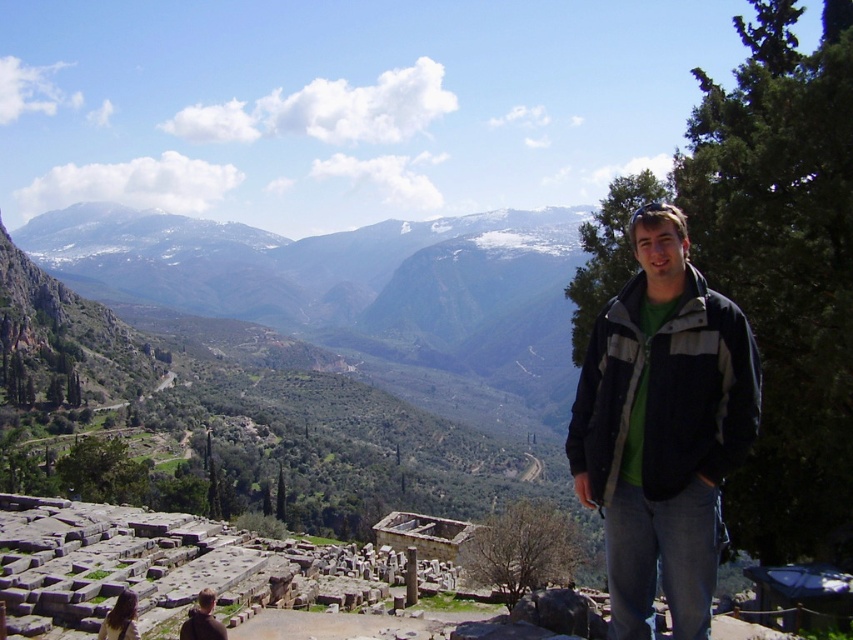
From the picture: You are standing at the ancient ruins and want to take a photo. You have two points marked on your camera screen to focus on. The first point is at coordinates point (706, 336), and the second is at point (200, 625). Which point should you focus on if you want the closest object in the scene to be sharp?

Point (706, 336) is closer to the viewer than point (200, 625), so you should focus on point (706, 336) to capture the closest object sharply.

You are a photographer trying to capture a wide shot of the mountain ruins. You notice the dark gray textured jacket at right and the brown hair at lower left in your frame. Which object should you adjust your camera angle to prioritize if you want to focus on the larger one?

The dark gray textured jacket at right should be prioritized because its width is larger than the brown hair at lower left.

You are a photographer trying to capture the ruins in the background. You notice the dark gray textured jacket at right and the brown hair at lower left are blocking your view. Which object should you move to ensure the ruins are fully visible?

You should move the dark gray textured jacket at right because it is in front of the brown hair at lower left and closer to the camera, so removing it would allow a clearer view of the ruins behind.